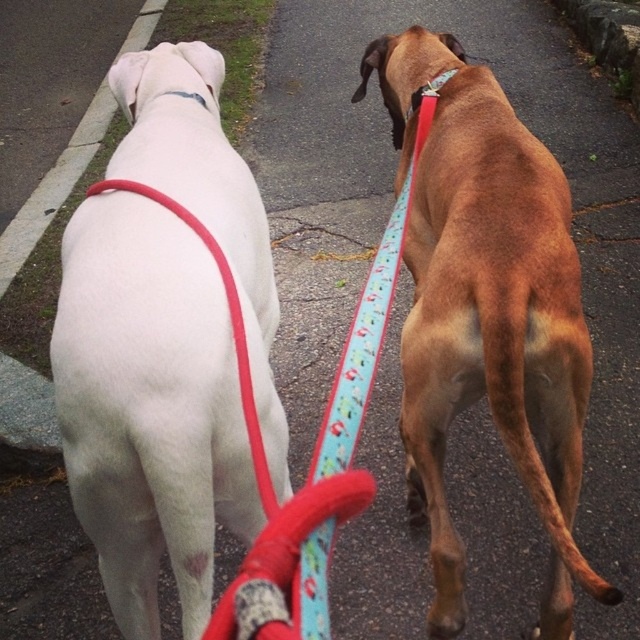
You are a dog owner who wants to ensure your pets are safe while walking. Given that the blue fabric leash at center is longer than the matte red collar at upper center, which of the two items allows for more freedom of movement for the dogs?

The blue fabric leash at center allows for more freedom of movement because it has a larger size compared to the matte red collar at upper center.

You are a photographer trying to capture a photo of the white matte dog at left and the matte red collar at upper center. Based on their positions, which one should you focus on first to ensure both are in frame?

The white matte dog at left is below the matte red collar at upper center, so you should focus on the matte red collar at upper center first to ensure both are in frame.